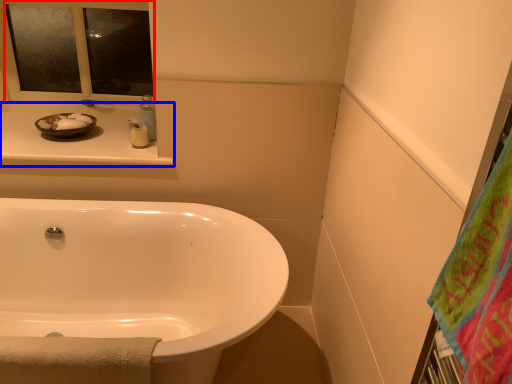
Question: Among these objects, which one is farthest to the camera, mirror (highlighted by a red box) or counter top (highlighted by a blue box)?

Choices:
 (A) mirror
 (B) counter top

Answer: (A)